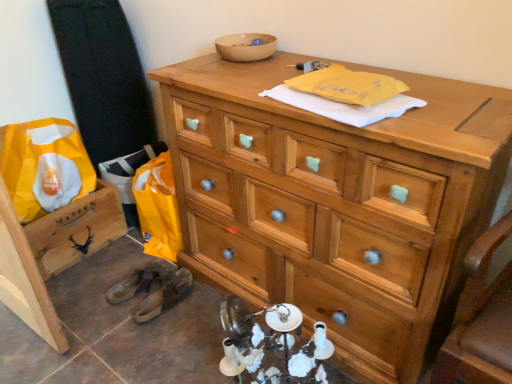
The height and width of the screenshot is (384, 512). Find the location of `vacant region in front of brown leather shoe at lower left, the second shoe in the right-to-left sequence`. vacant region in front of brown leather shoe at lower left, the second shoe in the right-to-left sequence is located at coordinates (126, 326).